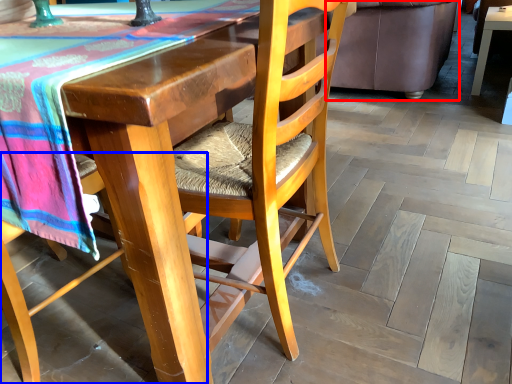
Question: Which of the following is the farthest to the observer, couch (highlighted by a red box) or chair (highlighted by a blue box)?

Choices:
 (A) couch
 (B) chair

Answer: (A)